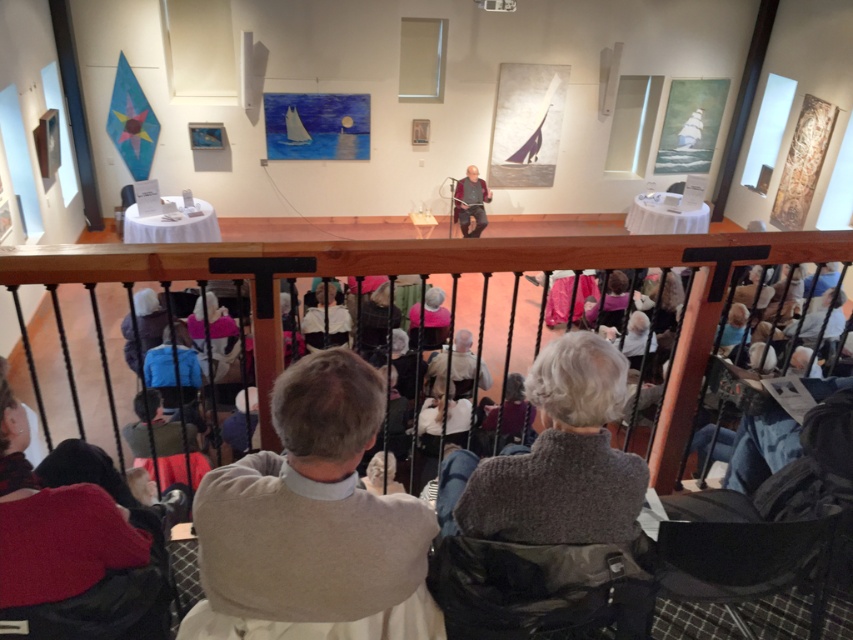
Which is in front, point (277, 365) or point (473, 172)?

Point (277, 365) is in front.

The image size is (853, 640). What do you see at coordinates (439, 273) in the screenshot?
I see `wooden railing at center` at bounding box center [439, 273].

Find the location of `wooden railing at center`. wooden railing at center is located at coordinates (439, 273).